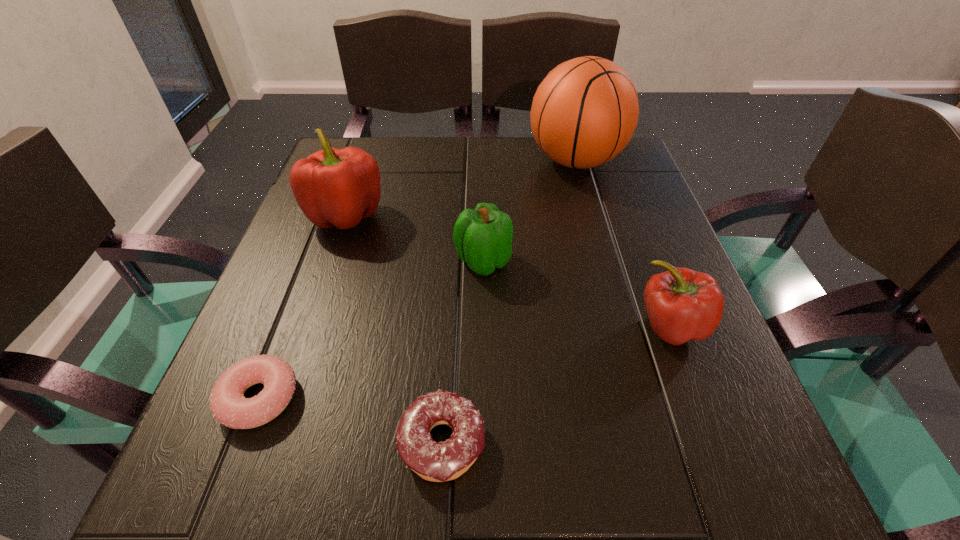
The height and width of the screenshot is (540, 960). Identify the location of the shortest object. (229, 407).

This screenshot has width=960, height=540. What are the coordinates of `the left doughnut` in the screenshot? It's located at (229, 407).

The width and height of the screenshot is (960, 540). I want to click on vacant area situated on the front of the basketball, so click(x=603, y=261).

This screenshot has height=540, width=960. I want to click on vacant space located 0.350m on the front of the second farthest object, so click(x=281, y=404).

Identify the location of vacant space located 0.170m on the right of the second bell pepper from right to left. This screenshot has width=960, height=540. (602, 261).

The height and width of the screenshot is (540, 960). In order to click on vacant space located on the front of the rightmost bell pepper in this screenshot , I will do `click(707, 422)`.

Image resolution: width=960 pixels, height=540 pixels. I want to click on free space located on the back of the right doughnut, so tap(454, 239).

The width and height of the screenshot is (960, 540). In order to click on vacant space located 0.240m on the right of the left doughnut in this screenshot , I will do `click(467, 398)`.

Identify the location of object that is at the far edge. The width and height of the screenshot is (960, 540). (585, 111).

Image resolution: width=960 pixels, height=540 pixels. Identify the location of object that is at the near edge. (438, 462).